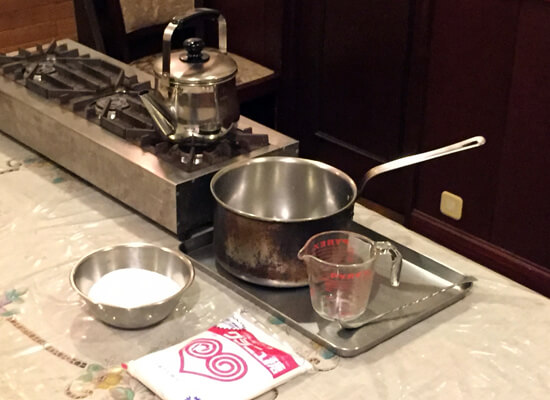
Where is `kitchen`? The image size is (550, 400). kitchen is located at coordinates (445, 205).